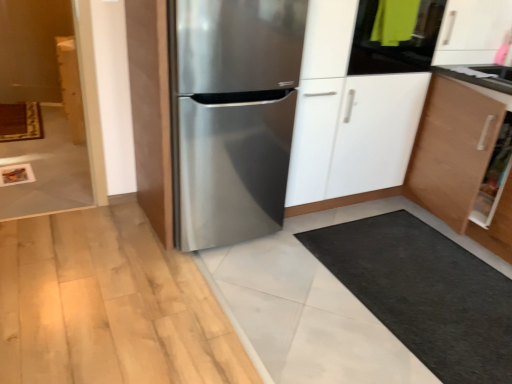
Question: Considering the relative sizes of wooden cabinet at left and stainless steel refrigerator at center in the image provided, is wooden cabinet at left taller than stainless steel refrigerator at center?

Choices:
 (A) no
 (B) yes

Answer: (A)

Question: From the image's perspective, would you say wooden cabinet at left is positioned over stainless steel refrigerator at center?

Choices:
 (A) yes
 (B) no

Answer: (A)

Question: Is stainless steel refrigerator at center located within wooden cabinet at left?

Choices:
 (A) yes
 (B) no

Answer: (B)

Question: From a real-world perspective, is wooden cabinet at left under stainless steel refrigerator at center?

Choices:
 (A) yes
 (B) no

Answer: (A)

Question: Is wooden cabinet at left thinner than stainless steel refrigerator at center?

Choices:
 (A) yes
 (B) no

Answer: (A)

Question: From a real-world perspective, is stainless steel refrigerator at center positioned above or below stainless steel refrigerator at center?

Choices:
 (A) below
 (B) above

Answer: (B)

Question: In the image, is stainless steel refrigerator at center positioned in front of or behind stainless steel refrigerator at center?

Choices:
 (A) front
 (B) behind

Answer: (B)

Question: Is stainless steel refrigerator at center situated inside stainless steel refrigerator at center or outside?

Choices:
 (A) inside
 (B) outside

Answer: (B)

Question: From the image's perspective, relative to stainless steel refrigerator at center, is stainless steel refrigerator at center above or below?

Choices:
 (A) below
 (B) above

Answer: (B)

Question: Based on their sizes in the image, would you say white glossy countertop at upper right is bigger or smaller than wooden cabinet at left?

Choices:
 (A) big
 (B) small

Answer: (B)

Question: Is point (487, 79) closer or farther from the camera than point (64, 54)?

Choices:
 (A) farther
 (B) closer

Answer: (B)

Question: From a real-world perspective, relative to wooden cabinet at left, is white glossy countertop at upper right vertically above or below?

Choices:
 (A) above
 (B) below

Answer: (A)

Question: Visually, is white glossy countertop at upper right positioned to the left or to the right of wooden cabinet at left?

Choices:
 (A) left
 (B) right

Answer: (B)

Question: Is stainless steel refrigerator at center taller or shorter than wooden cabinet at left?

Choices:
 (A) tall
 (B) short

Answer: (A)

Question: Based on their sizes in the image, would you say stainless steel refrigerator at center is bigger or smaller than wooden cabinet at left?

Choices:
 (A) big
 (B) small

Answer: (A)